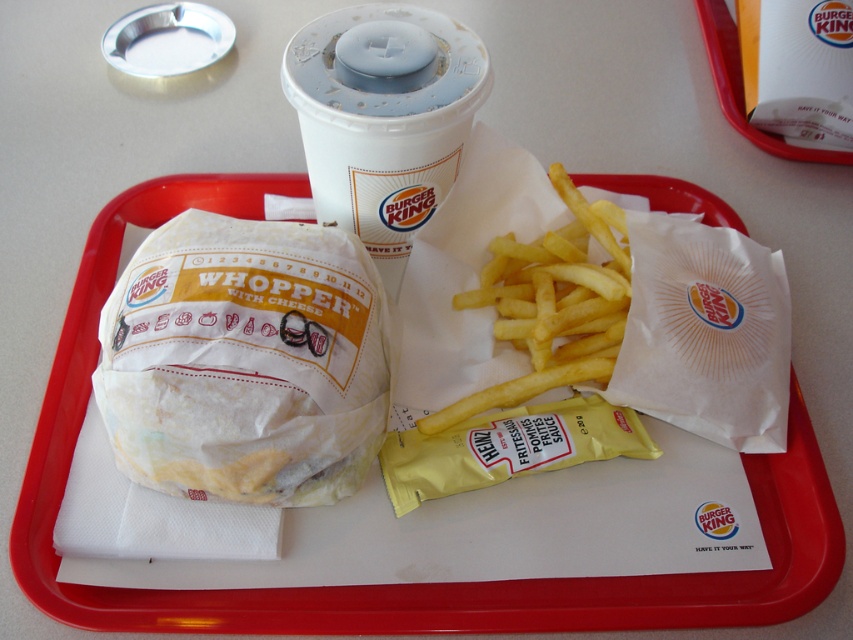
Question: Considering the relative positions of white paper whopper at left and white paper cup at upper center in the image provided, where is white paper whopper at left located with respect to white paper cup at upper center?

Choices:
 (A) above
 (B) below

Answer: (B)

Question: Can you confirm if white paper whopper at left is thinner than golden crispy french fries at center?

Choices:
 (A) yes
 (B) no

Answer: (B)

Question: Which object is farther from the camera taking this photo?

Choices:
 (A) golden crispy french fries at center
 (B) white paper cup at upper center

Answer: (A)

Question: Which object appears closest to the camera in this image?

Choices:
 (A) golden crispy french fries at center
 (B) white paper cup at upper center

Answer: (B)

Question: Is white paper whopper at left wider than golden crispy french fries at center?

Choices:
 (A) yes
 (B) no

Answer: (A)

Question: Considering the real-world distances, which object is farthest from the white paper cup at upper center?

Choices:
 (A) golden crispy french fries at center
 (B) white paper whopper at left

Answer: (B)